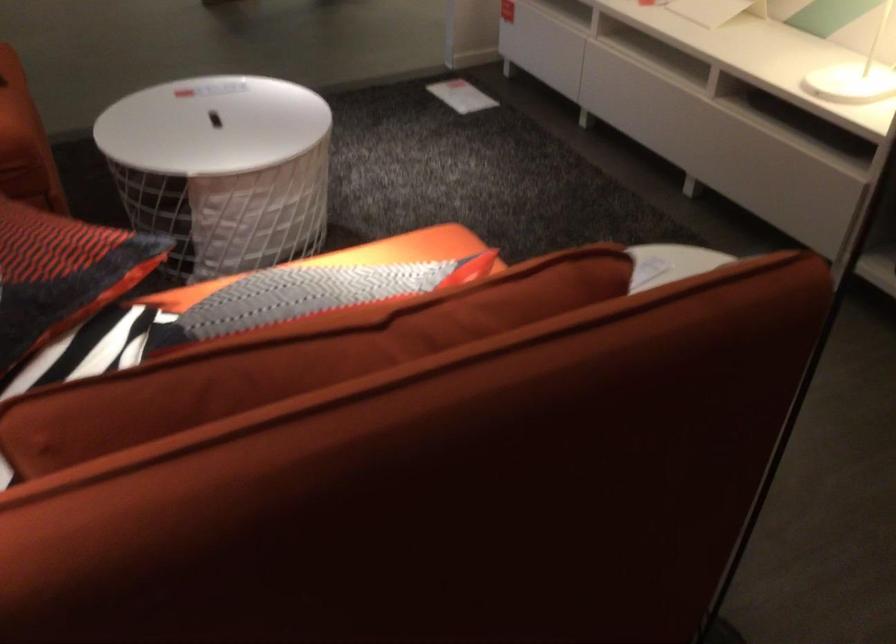
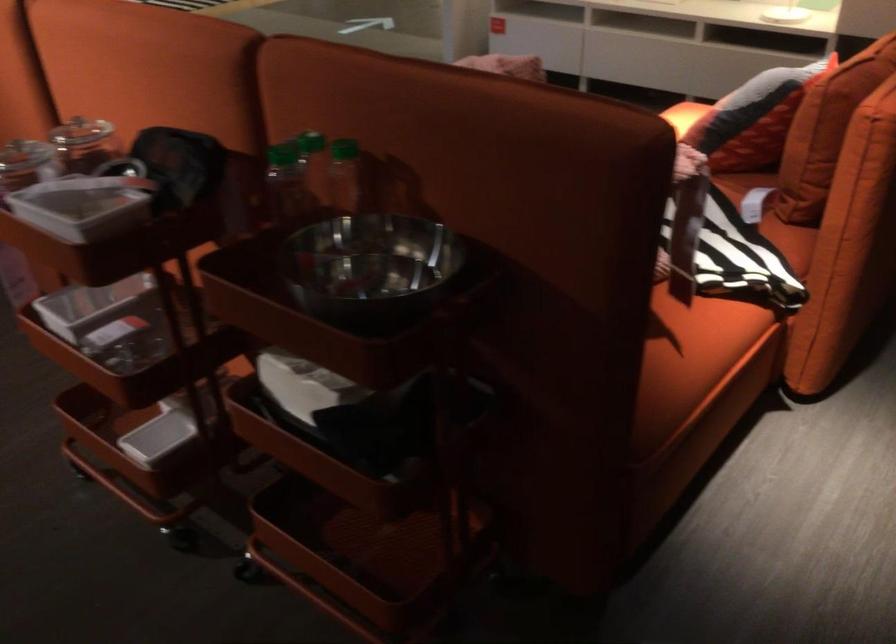
Question: In a continuous first-person perspective shot, in which direction is the camera moving?

Choices:
 (A) Left
 (B) Right
 (C) Forward
 (D) Backward

Answer: (A)